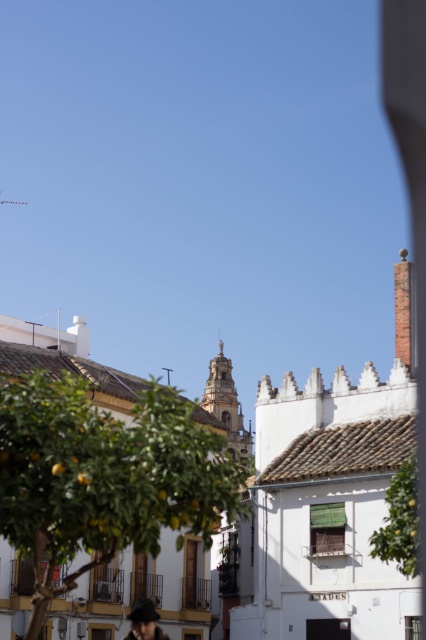
You are standing on the street in the Mediterranean town and want to find the point at coordinates (103, 477). Which object in the scene is this point located on?

The point at coordinates (103, 477) is located on the green leafy tree at center.

You are a tourist standing in the Mediterranean town and want to take a photo of the golden stone tower at center. However, there is a green leafy tree at center blocking your view. Can you still see the tower clearly?

The green leafy tree at center is in front of the golden stone tower at center, so the tree is blocking the view of the tower. Therefore, you cannot see the tower clearly.